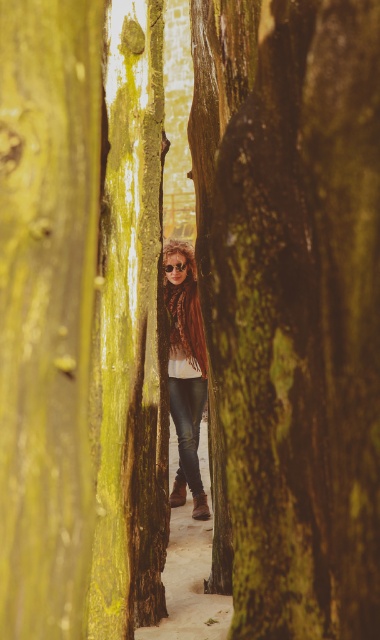
Question: Can you confirm if green mossy tree trunk at center is positioned to the right of shiny metallic goggles at center?

Choices:
 (A) no
 (B) yes

Answer: (B)

Question: Which object is positioned closest to the shiny metallic goggles at center?

Choices:
 (A) green mossy tree trunk at center
 (B) shiny brown hair at center

Answer: (B)

Question: Does green mossy tree trunk at center have a greater width compared to shiny brown hair at center?

Choices:
 (A) no
 (B) yes

Answer: (A)

Question: Which object is farther from the camera taking this photo?

Choices:
 (A) shiny metallic goggles at center
 (B) green mossy tree trunk at center

Answer: (A)

Question: Among these objects, which one is nearest to the camera?

Choices:
 (A) shiny brown hair at center
 (B) shiny metallic goggles at center

Answer: (A)

Question: Can you confirm if shiny brown hair at center is smaller than shiny metallic goggles at center?

Choices:
 (A) yes
 (B) no

Answer: (B)